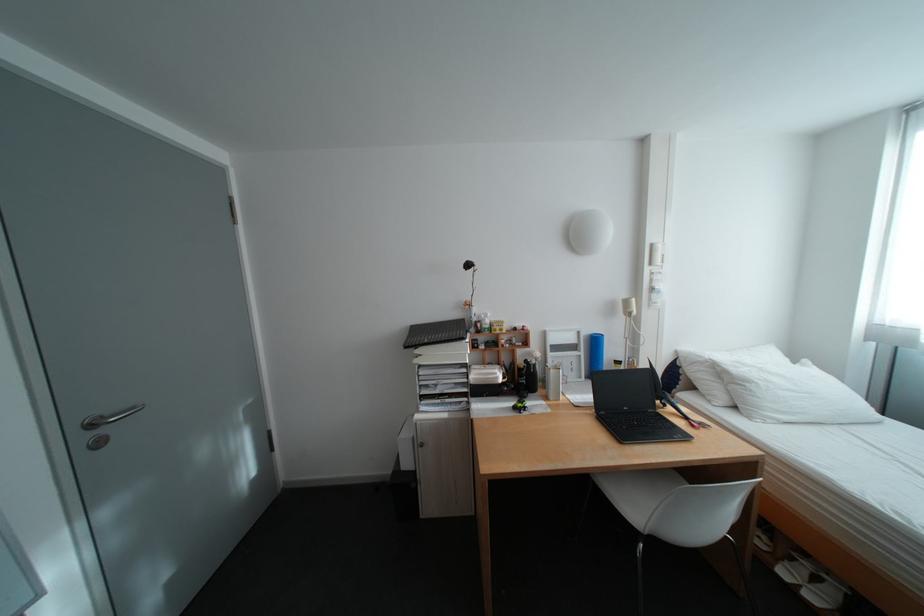
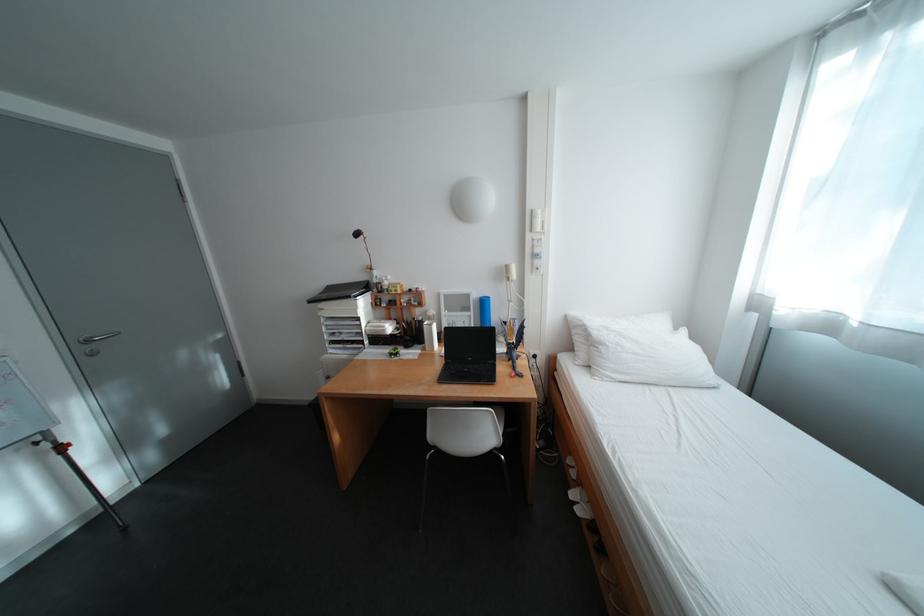
Find the pixel in the second image that matches (x=664, y=246) in the first image.

(544, 213)